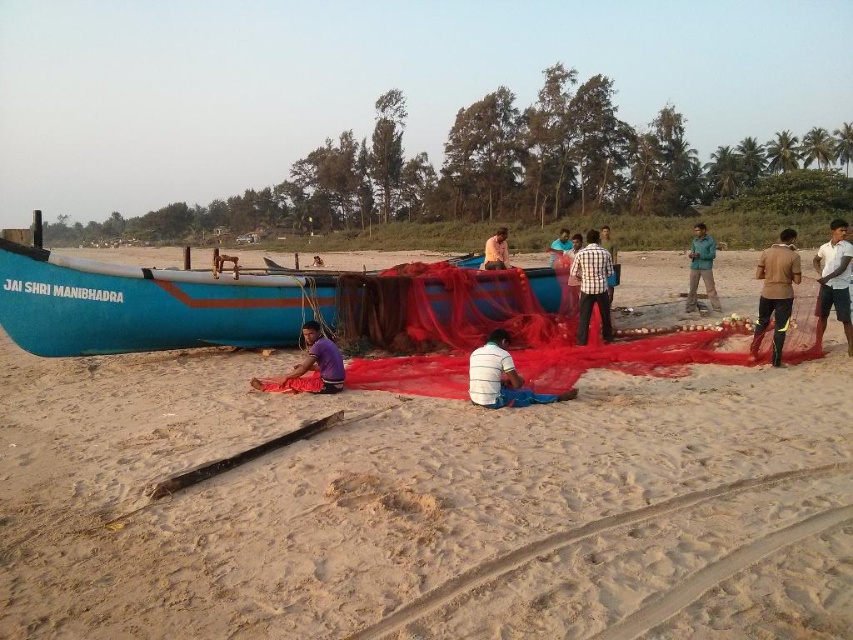
Question: Does brown leather jacket at right appear over green fabric at center?

Choices:
 (A) yes
 (B) no

Answer: (B)

Question: Based on their relative distances, which object is nearer to the checkered fabric shirt at center?

Choices:
 (A) blue painted boat at center
 (B) purple fabric at center
 (C) brown fabric at center
 (D) brown leather jacket at right

Answer: (D)

Question: Which point is closer to the camera?

Choices:
 (A) click(x=689, y=266)
 (B) click(x=502, y=237)
 (C) click(x=790, y=243)
 (D) click(x=578, y=326)

Answer: (C)

Question: Is blue painted boat at center positioned behind brown fabric at center?

Choices:
 (A) no
 (B) yes

Answer: (A)

Question: Can you confirm if blue painted boat at center is positioned below purple fabric at center?

Choices:
 (A) yes
 (B) no

Answer: (B)

Question: Which point is farther from the camera taking this photo?

Choices:
 (A) (318, 378)
 (B) (834, 257)

Answer: (B)